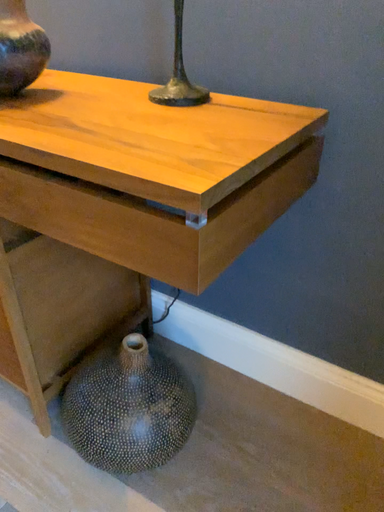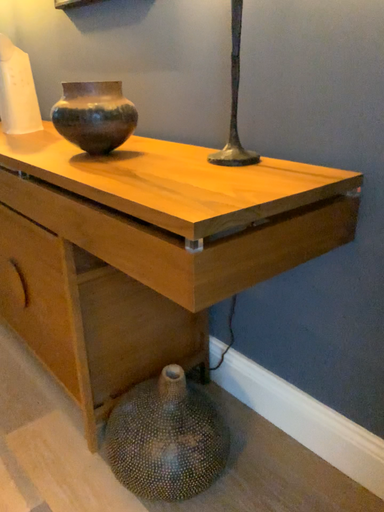
Question: Which way did the camera rotate in the video?

Choices:
 (A) rotated downward
 (B) rotated upward

Answer: (B)